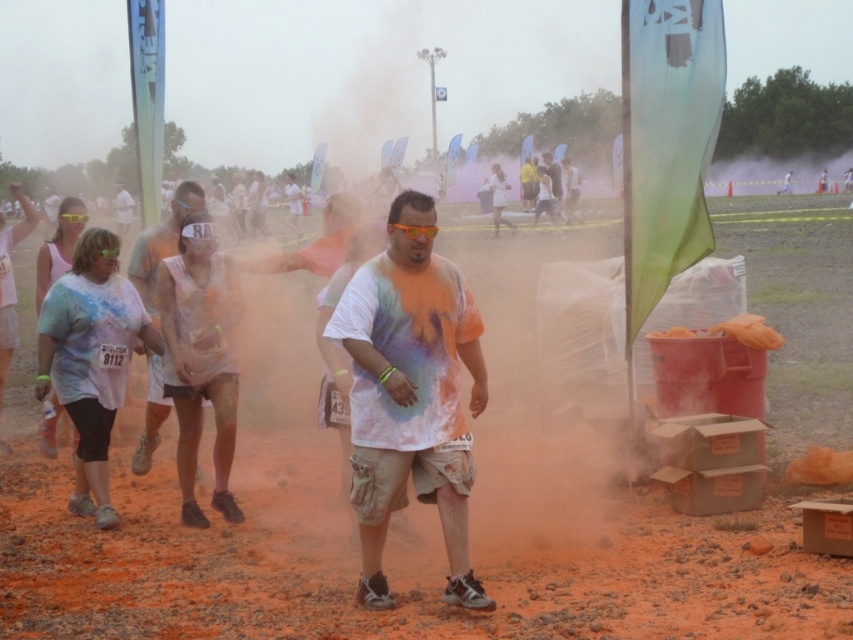
Question: From the image, what is the correct spatial relationship of tie-dye t-shirt at center in relation to white tie-dye shirt at center?

Choices:
 (A) below
 (B) above

Answer: (A)

Question: Is the position of multicolored tie-dye shirt at center less distant than that of white tie-dye shirt at center?

Choices:
 (A) no
 (B) yes

Answer: (B)

Question: Which point is farther to the camera?

Choices:
 (A) (424, 364)
 (B) (154, 227)

Answer: (B)

Question: Based on their relative distances, which object is farther from the tie-dye t-shirt at center?

Choices:
 (A) multicolored tie-dye shirt at center
 (B) white tie-dye shirt at center

Answer: (B)

Question: Which point appears closest to the camera in this image?

Choices:
 (A) [x=196, y=474]
 (B) [x=361, y=301]

Answer: (B)

Question: Is tie-dye t-shirt at center smaller than multicolored tie-dye shirt at center?

Choices:
 (A) no
 (B) yes

Answer: (A)